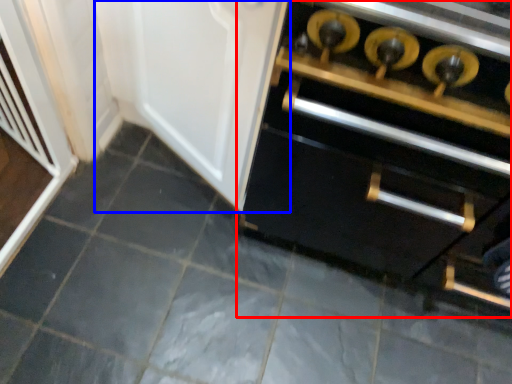
Question: Which object is further to the camera taking this photo, cabinetry (highlighted by a red box) or door (highlighted by a blue box)?

Choices:
 (A) cabinetry
 (B) door

Answer: (B)